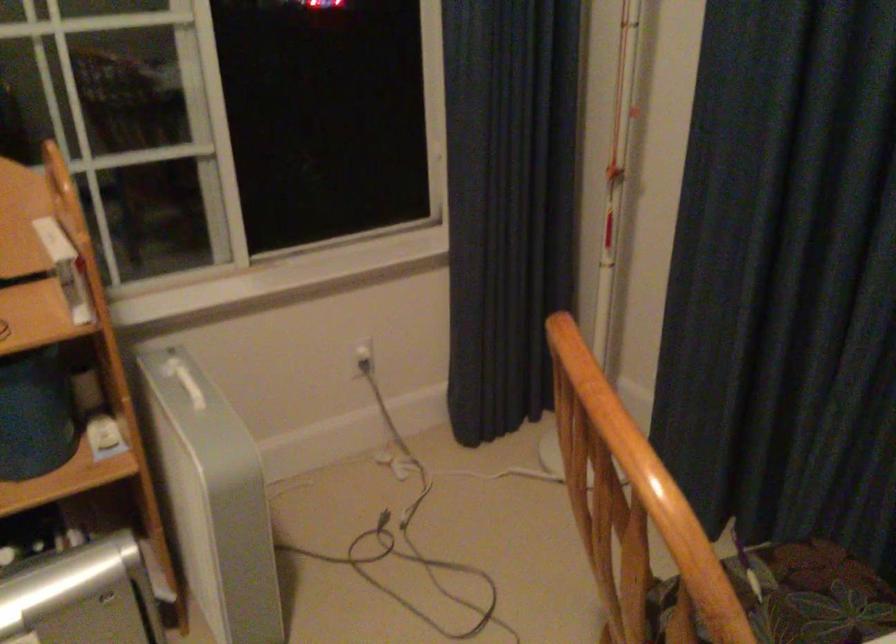
Find where to lift the white rectangular box. Please return your answer as a coordinate pair (x, y).

(211, 498)